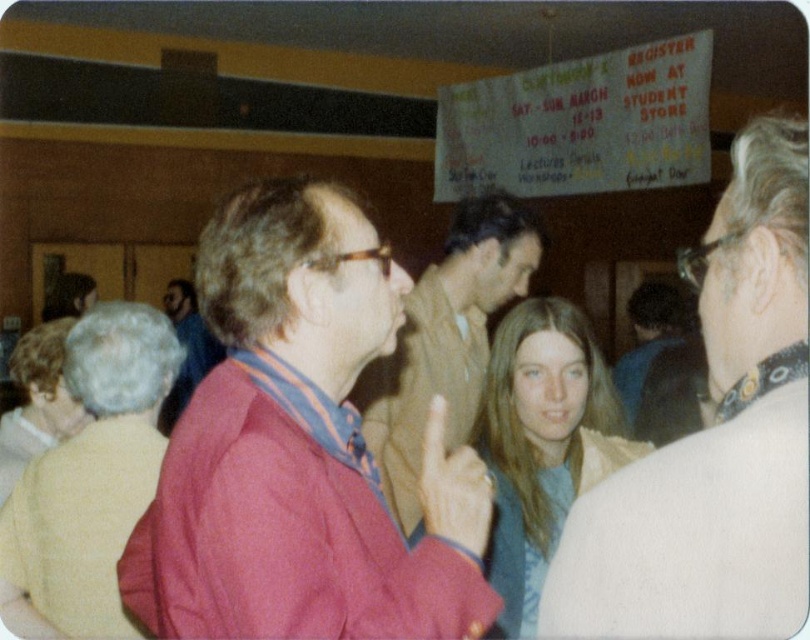
Question: Among these objects, which one is nearest to the camera?

Choices:
 (A) matte red jacket at center
 (B) dark blue shirt at center
 (C) matte red shirt at center

Answer: (A)

Question: Estimate the real-world distances between objects in this image. Which object is farther from the light yellow sweater at lower left?

Choices:
 (A) white textured shirt at upper right
 (B) matte red shirt at center

Answer: (A)

Question: Which of the following is the closest to the observer?

Choices:
 (A) matte red shirt at center
 (B) matte red jacket at center

Answer: (B)

Question: Is matte red jacket at center to the right of white textured shirt at upper right from the viewer's perspective?

Choices:
 (A) no
 (B) yes

Answer: (A)

Question: Can you confirm if matte red jacket at center is positioned to the right of light yellow sweater at lower left?

Choices:
 (A) no
 (B) yes

Answer: (B)

Question: Does matte red jacket at center have a smaller size compared to blonde hair at center?

Choices:
 (A) yes
 (B) no

Answer: (B)